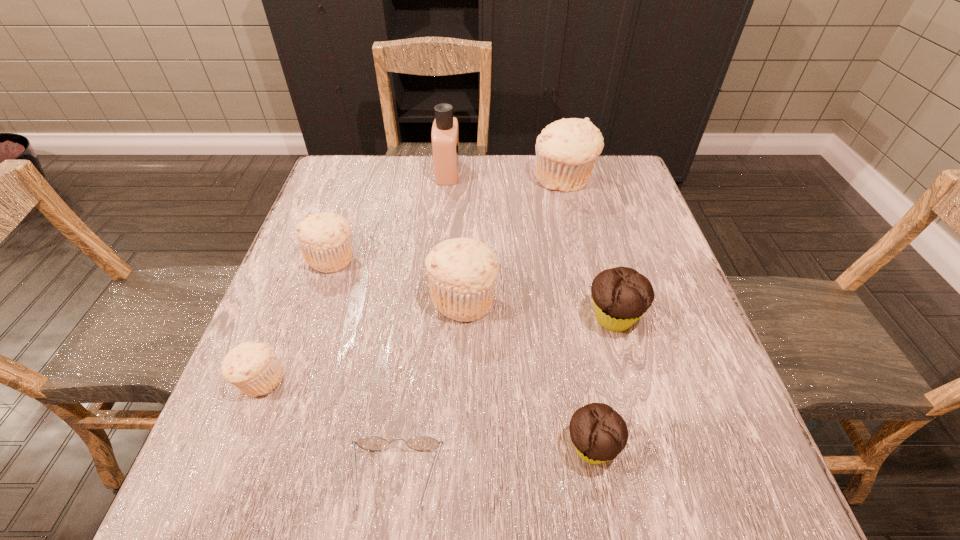
Identify the location of beige perfume. (445, 133).

Identify the location of the biggest beige muffin. (566, 150).

Locate an element on the screen. the farthest muffin is located at coordinates (566, 150).

Where is `the sixth shortest object`? The height and width of the screenshot is (540, 960). the sixth shortest object is located at coordinates (462, 272).

Where is `the fifth shortest muffin`? the fifth shortest muffin is located at coordinates (462, 272).

You are a GUI agent. You are given a task and a screenshot of the screen. Output one action in this format:
    pyautogui.click(x=<x>, y=<y>)
    Task: Click on the second smallest beige muffin
    
    Given the screenshot: What is the action you would take?
    pyautogui.click(x=324, y=238)

The width and height of the screenshot is (960, 540). I want to click on the bigger chocolate muffin, so click(x=621, y=295).

Locate an element on the screen. Image resolution: width=960 pixels, height=540 pixels. the sixth farthest object is located at coordinates (253, 367).

This screenshot has width=960, height=540. I want to click on the smallest beige muffin, so click(253, 367).

I want to click on the nearest muffin, so click(x=599, y=433).